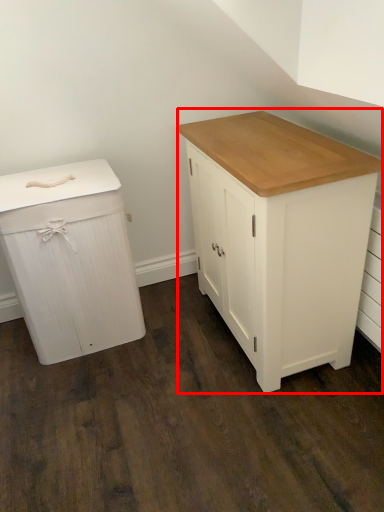
Question: From the image's perspective, what is the correct spatial positioning of chest of drawers (annotated by the red box) in reference to chest of drawers?

Choices:
 (A) above
 (B) below

Answer: (A)